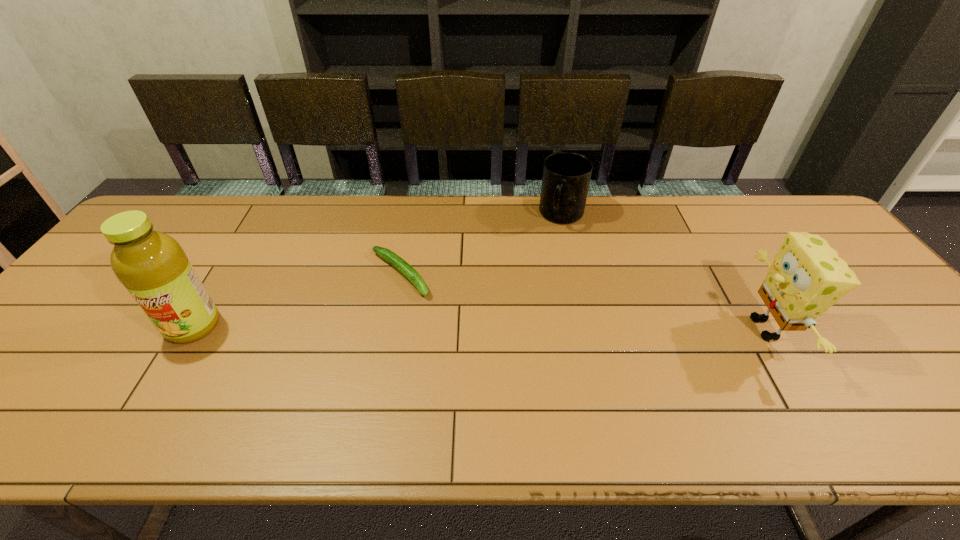
Locate an element on the screen. Image resolution: width=960 pixels, height=540 pixels. free space in the image that satisfies the following two spatial constraints: 1. on the front label of the second tallest object; 2. on the face of the fruit juice is located at coordinates (192, 328).

Locate an element on the screen. The height and width of the screenshot is (540, 960). vacant space that satisfies the following two spatial constraints: 1. on the front label of the rightmost object; 2. on the face of the fruit juice is located at coordinates (192, 328).